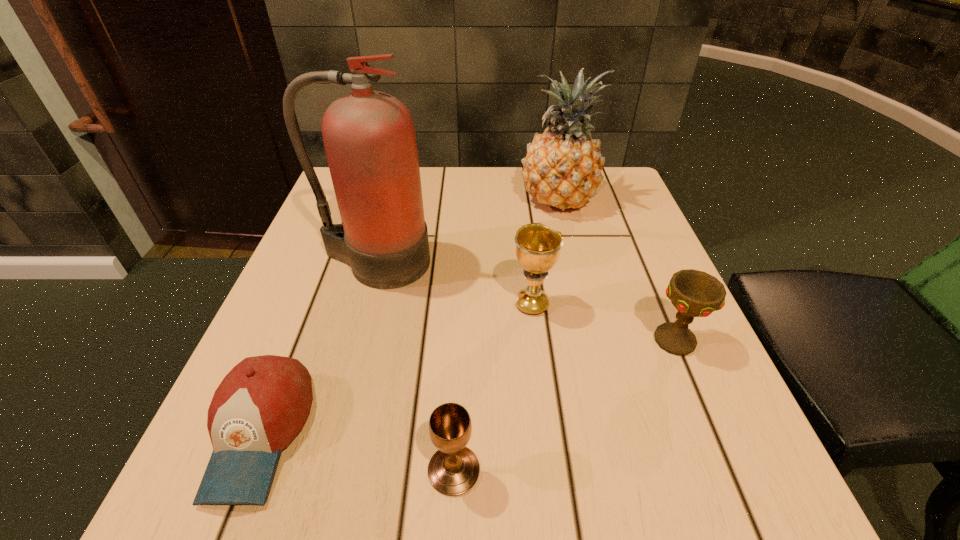
Locate an element on the screen. free space located at the nozzle of the tallest object is located at coordinates (324, 452).

Identify the location of vacant position located on the left of the fifth shortest object. (382, 201).

In order to click on vacant area located on the front of the fourth shortest object in this screenshot , I will do `click(557, 505)`.

Image resolution: width=960 pixels, height=540 pixels. What are the coordinates of `free region located 0.270m on the left of the second nearest chalice` in the screenshot? It's located at (490, 341).

Locate an element on the screen. Image resolution: width=960 pixels, height=540 pixels. vacant space positioned on the left of the third object from left to right is located at coordinates (269, 470).

Identify the location of object positioned at the far edge. The width and height of the screenshot is (960, 540). (562, 168).

You are a GUI agent. You are given a task and a screenshot of the screen. Output one action in this format:
    pyautogui.click(x=<x>, y=<y>)
    Task: Click on the chalice that is at the near edge
    
    Given the screenshot: What is the action you would take?
    pyautogui.click(x=453, y=470)

The height and width of the screenshot is (540, 960). Find the location of `baseball cap that is at the near edge`. baseball cap that is at the near edge is located at coordinates (261, 405).

You are a GUI agent. You are given a task and a screenshot of the screen. Output one action in this format:
    pyautogui.click(x=<x>, y=<y>)
    Task: Click on the fire extinguisher situated at the left edge
    Image resolution: width=960 pixels, height=540 pixels.
    Given the screenshot: What is the action you would take?
    pyautogui.click(x=369, y=137)

In order to click on baseball cap that is at the left edge in this screenshot , I will do `click(261, 405)`.